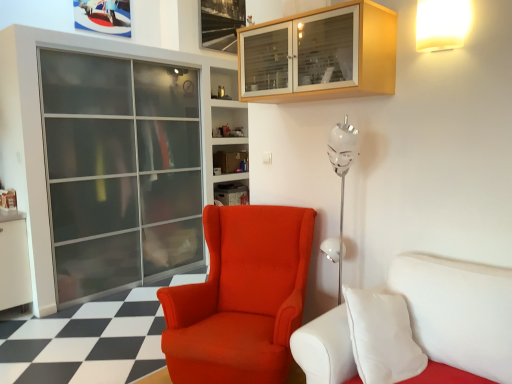
Question: Visually, is wooden cabinet at upper center positioned to the left or to the right of white matte wall lamp at upper right?

Choices:
 (A) right
 (B) left

Answer: (B)

Question: From their relative heights in the image, would you say wooden cabinet at upper center is taller or shorter than white matte wall lamp at upper right?

Choices:
 (A) tall
 (B) short

Answer: (A)

Question: Which object is positioned farthest from the white matte wall lamp at upper right?

Choices:
 (A) transparent glass screen door at left
 (B) wooden cabinet at upper center
 (C) white leather studio couch at lower right
 (D) matte plastic shelf at center
 (E) satin orange armchair at center

Answer: (D)

Question: Which is farther from the wooden cabinet at upper center?

Choices:
 (A) transparent glass screen door at left
 (B) white leather studio couch at lower right
 (C) satin orange armchair at center
 (D) white matte wall lamp at upper right
 (E) matte plastic shelf at center

Answer: (E)